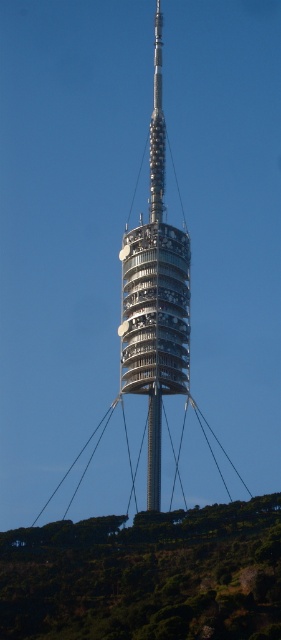
Question: Is green leafy hillside at lower center positioned at the back of shiny metallic pole at center?

Choices:
 (A) no
 (B) yes

Answer: (A)

Question: Which point is closer to the camera?

Choices:
 (A) (236, 563)
 (B) (152, 428)

Answer: (A)

Question: Does green leafy hillside at lower center appear on the right side of shiny metallic pole at center?

Choices:
 (A) no
 (B) yes

Answer: (A)

Question: Which of the following is the closest to the observer?

Choices:
 (A) shiny metallic pole at center
 (B) green leafy hillside at lower center

Answer: (B)

Question: Is green leafy hillside at lower center thinner than shiny metallic pole at center?

Choices:
 (A) no
 (B) yes

Answer: (A)